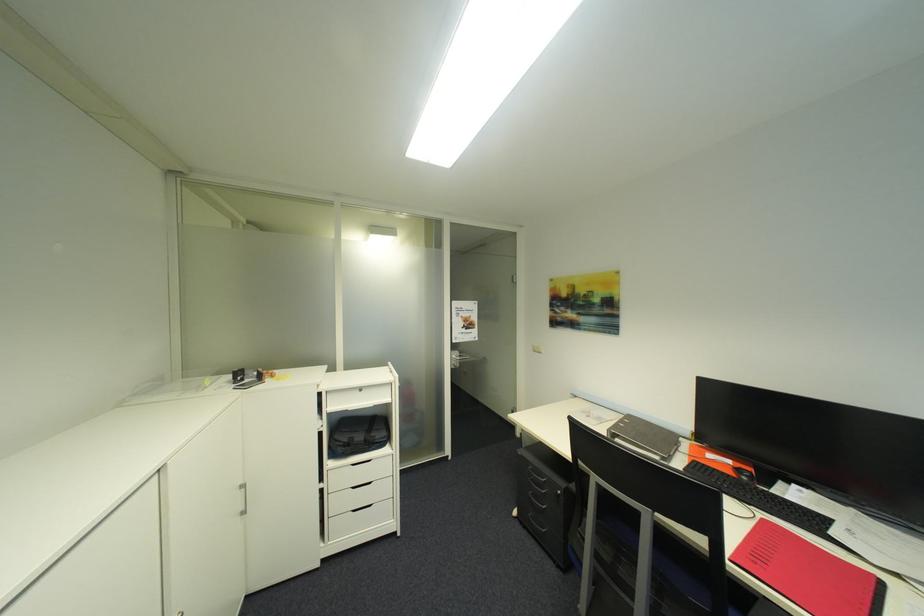
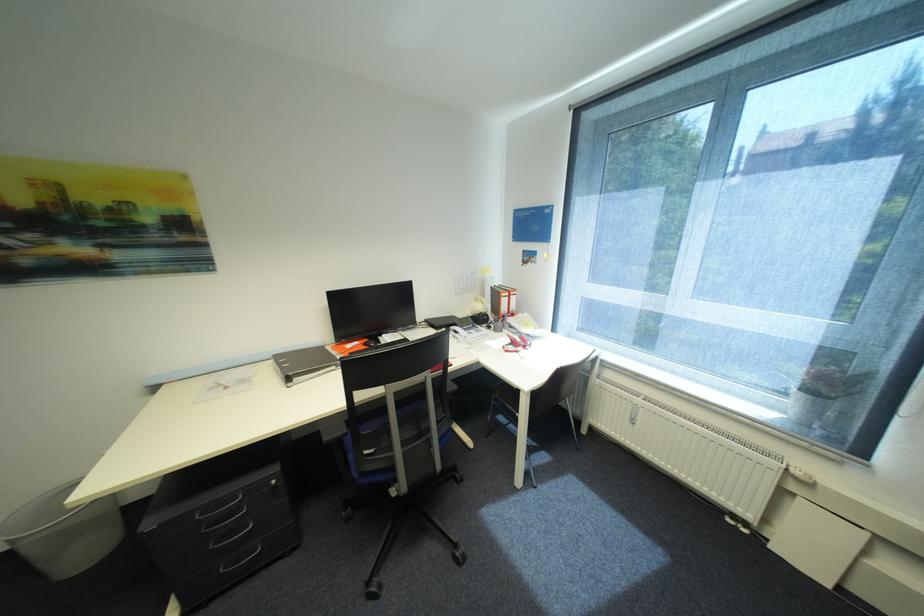
Locate, in the second image, the point that corresponds to point (538, 468) in the first image.

(205, 516)